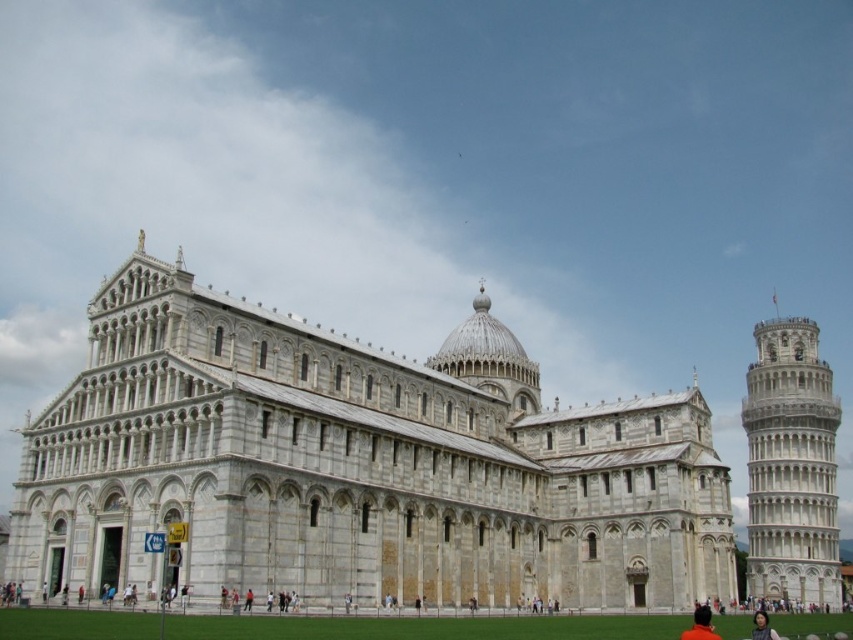
Question: Which of the following is the farthest from the observer?

Choices:
 (A) smooth skin face at lower right
 (B) white marble tower at right
 (C) white stone cathedral at center

Answer: (B)

Question: Does white marble tower at right have a larger size compared to smooth skin face at lower right?

Choices:
 (A) no
 (B) yes

Answer: (B)

Question: Is white stone cathedral at center positioned behind smooth skin face at lower right?

Choices:
 (A) no
 (B) yes

Answer: (B)

Question: Which object is the farthest from the white stone cathedral at center?

Choices:
 (A) smooth skin face at lower right
 (B) white marble tower at right

Answer: (B)

Question: Does white marble tower at right have a lesser width compared to smooth skin face at lower right?

Choices:
 (A) yes
 (B) no

Answer: (B)

Question: Which object is closer to the camera taking this photo?

Choices:
 (A) white stone cathedral at center
 (B) white marble tower at right
 (C) smooth skin face at lower right

Answer: (C)